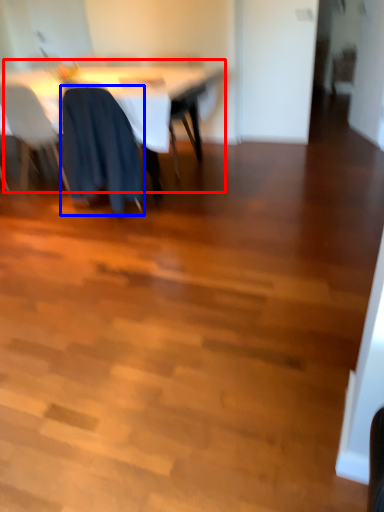
Question: Which point is further to the camera, table (highlighted by a red box) or chair (highlighted by a blue box)?

Choices:
 (A) table
 (B) chair

Answer: (A)